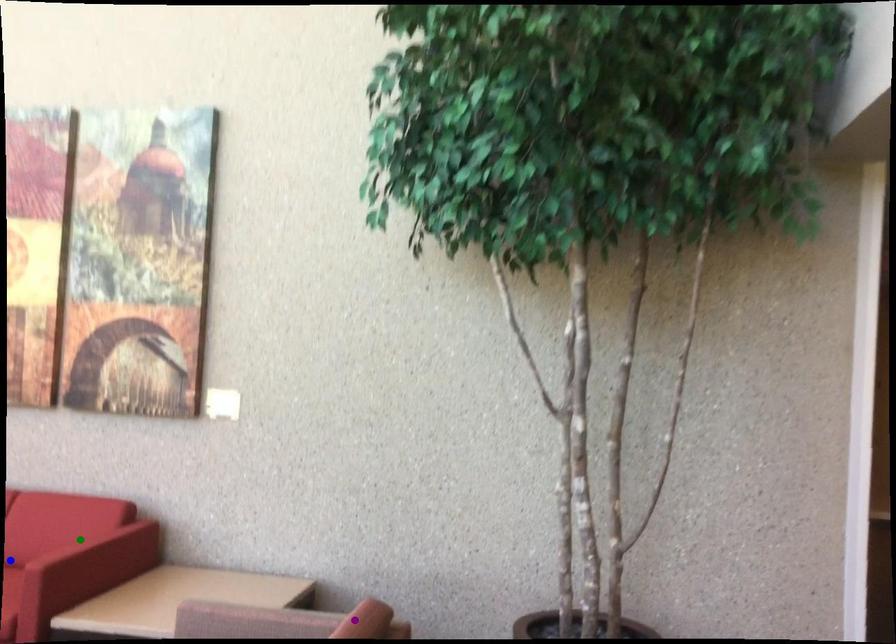
Order these from nearest to farthest:
purple point
green point
blue point

purple point
green point
blue point